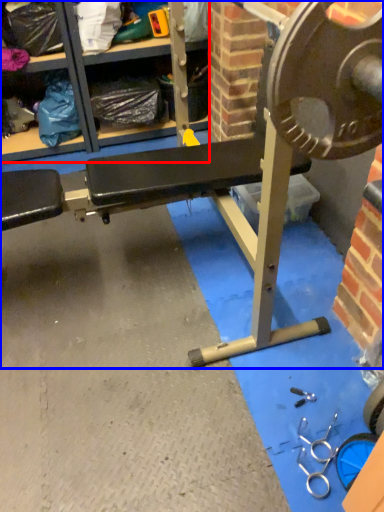
Question: Which point is further to the camera, shelf (highlighted by a red box) or bench (highlighted by a blue box)?

Choices:
 (A) shelf
 (B) bench

Answer: (A)